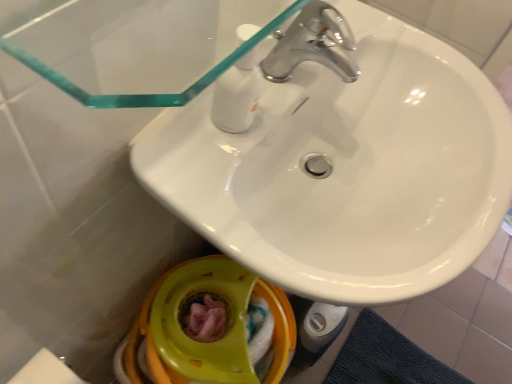
This screenshot has width=512, height=384. I want to click on chrome metallic faucet at upper center, which is the first tap from bottom to top, so click(312, 45).

The image size is (512, 384). Describe the element at coordinates (206, 343) in the screenshot. I see `matte yellow plastic toilet bowl at lower center` at that location.

Image resolution: width=512 pixels, height=384 pixels. What do you see at coordinates (346, 169) in the screenshot?
I see `white glossy sink at upper center` at bounding box center [346, 169].

Measure the distance between point (479,251) and camera.

Point (479,251) is 23.11 inches from camera.

You are a GUI agent. You are given a task and a screenshot of the screen. Output one action in this format:
    pyautogui.click(x=<x>, y=<y>)
    Task: Click on the chrome metallic faucet at upper center, which is the first tap from bottom to top
    Image resolution: width=512 pixels, height=384 pixels.
    Given the screenshot: What is the action you would take?
    pyautogui.click(x=312, y=45)

Would you say chrome metallic faucet at upper center, which is the first tap from bottom to top, is outside white glossy sink at upper center?

Absolutely, chrome metallic faucet at upper center, which is the first tap from bottom to top, is external to white glossy sink at upper center.

How many degrees apart are the facing directions of chrome metallic faucet at upper center, the second tap from the top, and white glossy sink at upper center?

They differ by 0.000368 degrees in their facing directions.

From a real-world perspective, which is physically below, chrome metallic faucet at upper center, the second tap from the top, or white glossy sink at upper center?

white glossy sink at upper center is physically lower.

Considering the sizes of objects chrome metallic faucet at upper center, the second tap from the top, and white glossy sink at upper center in the image provided, who is smaller, chrome metallic faucet at upper center, the second tap from the top, or white glossy sink at upper center?

chrome metallic faucet at upper center, the second tap from the top.

Between chrome metallic faucet at upper center, the 1th tap viewed from the top, and chrome metallic faucet at upper center, which is the first tap from bottom to top, which one appears on the right side from the viewer's perspective?

Positioned to the right is chrome metallic faucet at upper center, the 1th tap viewed from the top.

Can you confirm if chrome metallic faucet at upper center, arranged as the 2th tap when ordered from the bottom, is bigger than chrome metallic faucet at upper center, which is the first tap from bottom to top?

Incorrect, chrome metallic faucet at upper center, arranged as the 2th tap when ordered from the bottom, is not larger than chrome metallic faucet at upper center, which is the first tap from bottom to top.

Is chrome metallic faucet at upper center, arranged as the 2th tap when ordered from the bottom, looking in the opposite direction of chrome metallic faucet at upper center, which is the first tap from bottom to top?

No, chrome metallic faucet at upper center, arranged as the 2th tap when ordered from the bottom, is not facing the opposite direction of chrome metallic faucet at upper center, which is the first tap from bottom to top.

Is chrome metallic faucet at upper center, the 1th tap viewed from the top, placed right next to chrome metallic faucet at upper center, the second tap from the top?

Yes, chrome metallic faucet at upper center, the 1th tap viewed from the top, is right next to chrome metallic faucet at upper center, the second tap from the top, and making contact.

Is chrome metallic faucet at upper center, the 1th tap viewed from the top, at the back of chrome metallic faucet at upper center, which is the first tap from bottom to top?

No, chrome metallic faucet at upper center, which is the first tap from bottom to top,'s orientation is not away from chrome metallic faucet at upper center, the 1th tap viewed from the top.

Considering the sizes of chrome metallic faucet at upper center, which is the first tap from bottom to top, and chrome metallic faucet at upper center, arranged as the 2th tap when ordered from the bottom, in the image, is chrome metallic faucet at upper center, which is the first tap from bottom to top, taller or shorter than chrome metallic faucet at upper center, arranged as the 2th tap when ordered from the bottom,?

Clearly, chrome metallic faucet at upper center, which is the first tap from bottom to top, is taller compared to chrome metallic faucet at upper center, arranged as the 2th tap when ordered from the bottom.

Which object is wider, chrome metallic faucet at upper center, which is the first tap from bottom to top, or chrome metallic faucet at upper center, the 1th tap viewed from the top?

With larger width is chrome metallic faucet at upper center, which is the first tap from bottom to top.

Which object is positioned more to the right, chrome metallic faucet at upper center, the second tap from the top, or chrome metallic faucet at upper center, arranged as the 2th tap when ordered from the bottom?

From the viewer's perspective, chrome metallic faucet at upper center, arranged as the 2th tap when ordered from the bottom, appears more on the right side.

Measure the distance from matte yellow plastic toilet bowl at lower center to chrome metallic faucet at upper center, the 1th tap viewed from the top.

matte yellow plastic toilet bowl at lower center and chrome metallic faucet at upper center, the 1th tap viewed from the top, are 20.88 inches apart from each other.

Who is shorter, matte yellow plastic toilet bowl at lower center or chrome metallic faucet at upper center, the 1th tap viewed from the top?

chrome metallic faucet at upper center, the 1th tap viewed from the top, is shorter.

At what (x,y) coordinates should I click in order to perform the action: click on toilet bowl located below the chrome metallic faucet at upper center, the 1th tap viewed from the top (from the image's perspective). Please return your answer as a coordinate pair (x, y). Image resolution: width=512 pixels, height=384 pixels. Looking at the image, I should click on click(x=206, y=343).

Does matte yellow plastic toilet bowl at lower center have a lesser width compared to chrome metallic faucet at upper center, the 1th tap viewed from the top?

No, matte yellow plastic toilet bowl at lower center is not thinner than chrome metallic faucet at upper center, the 1th tap viewed from the top.

Considering the positions of point (226, 351) and point (346, 76), is point (226, 351) closer or farther from the camera than point (346, 76)?

Point (226, 351) appears to be farther away from the viewer than point (346, 76).

Between matte yellow plastic toilet bowl at lower center and chrome metallic faucet at upper center, the second tap from the top, which one has larger size?

matte yellow plastic toilet bowl at lower center.

Can you confirm if matte yellow plastic toilet bowl at lower center is positioned to the right of chrome metallic faucet at upper center, which is the first tap from bottom to top?

In fact, matte yellow plastic toilet bowl at lower center is to the left of chrome metallic faucet at upper center, which is the first tap from bottom to top.

Are matte yellow plastic toilet bowl at lower center and chrome metallic faucet at upper center, the second tap from the top, making contact?

matte yellow plastic toilet bowl at lower center and chrome metallic faucet at upper center, the second tap from the top, are clearly separated.

Which is correct: chrome metallic faucet at upper center, the second tap from the top, is inside matte yellow plastic toilet bowl at lower center, or outside of it?

Answer: chrome metallic faucet at upper center, the second tap from the top, is spatially situated outside matte yellow plastic toilet bowl at lower center.

Does chrome metallic faucet at upper center, which is the first tap from bottom to top, come in front of matte yellow plastic toilet bowl at lower center?

Yes, it is in front of matte yellow plastic toilet bowl at lower center.

Are chrome metallic faucet at upper center, the second tap from the top, and matte yellow plastic toilet bowl at lower center located far from each other?

They are positioned close to each other.

From the picture: Is chrome metallic faucet at upper center, arranged as the 2th tap when ordered from the bottom, wider than matte yellow plastic toilet bowl at lower center?

In fact, chrome metallic faucet at upper center, arranged as the 2th tap when ordered from the bottom, might be narrower than matte yellow plastic toilet bowl at lower center.

From the image's perspective, would you say chrome metallic faucet at upper center, the 1th tap viewed from the top, is shown under matte yellow plastic toilet bowl at lower center?

Incorrect, from the image's perspective, chrome metallic faucet at upper center, the 1th tap viewed from the top, is higher than matte yellow plastic toilet bowl at lower center.

The image size is (512, 384). There is a matte yellow plastic toilet bowl at lower center. Identify the location of the 1st tap above it (from a real-world perspective). tap(313, 44).

Locate an element on the screen. The width and height of the screenshot is (512, 384). sink located underneath the chrome metallic faucet at upper center, which is the first tap from bottom to top (from a real-world perspective) is located at coordinates (346, 169).

This screenshot has width=512, height=384. Identify the location of tap below the chrome metallic faucet at upper center, arranged as the 2th tap when ordered from the bottom (from the image's perspective). (312, 45).

Which object lies nearer to the anchor point matte yellow plastic toilet bowl at lower center, chrome metallic faucet at upper center, the second tap from the top, or chrome metallic faucet at upper center, arranged as the 2th tap when ordered from the bottom?

The object closer to matte yellow plastic toilet bowl at lower center is chrome metallic faucet at upper center, the second tap from the top.

From the image, which object appears to be nearer to white glossy sink at upper center, chrome metallic faucet at upper center, which is the first tap from bottom to top, or matte yellow plastic toilet bowl at lower center?

chrome metallic faucet at upper center, which is the first tap from bottom to top, lies closer to white glossy sink at upper center than the other object.

Based on their spatial positions, is white glossy sink at upper center or chrome metallic faucet at upper center, arranged as the 2th tap when ordered from the bottom, closer to chrome metallic faucet at upper center, the second tap from the top?

chrome metallic faucet at upper center, arranged as the 2th tap when ordered from the bottom, is closer to chrome metallic faucet at upper center, the second tap from the top.

Considering their positions, is white glossy sink at upper center positioned closer to matte yellow plastic toilet bowl at lower center than chrome metallic faucet at upper center, arranged as the 2th tap when ordered from the bottom?

white glossy sink at upper center lies closer to matte yellow plastic toilet bowl at lower center than the other object.

From the image, which object appears to be nearer to chrome metallic faucet at upper center, the second tap from the top, chrome metallic faucet at upper center, arranged as the 2th tap when ordered from the bottom, or matte yellow plastic toilet bowl at lower center?

chrome metallic faucet at upper center, arranged as the 2th tap when ordered from the bottom, lies closer to chrome metallic faucet at upper center, the second tap from the top, than the other object.

When comparing their distances from chrome metallic faucet at upper center, the 1th tap viewed from the top, does chrome metallic faucet at upper center, the second tap from the top, or white glossy sink at upper center seem further?

Based on the image, white glossy sink at upper center appears to be further to chrome metallic faucet at upper center, the 1th tap viewed from the top.

Based on their spatial positions, is chrome metallic faucet at upper center, the second tap from the top, or matte yellow plastic toilet bowl at lower center further from chrome metallic faucet at upper center, arranged as the 2th tap when ordered from the bottom?

matte yellow plastic toilet bowl at lower center lies further to chrome metallic faucet at upper center, arranged as the 2th tap when ordered from the bottom, than the other object.

From the image, which object appears to be farther from chrome metallic faucet at upper center, the 1th tap viewed from the top, matte yellow plastic toilet bowl at lower center or white glossy sink at upper center?

Based on the image, matte yellow plastic toilet bowl at lower center appears to be further to chrome metallic faucet at upper center, the 1th tap viewed from the top.

Locate an element on the screen. tap between chrome metallic faucet at upper center, the 1th tap viewed from the top, and matte yellow plastic toilet bowl at lower center from top to bottom is located at coordinates (312, 45).

The image size is (512, 384). In order to click on sink between chrome metallic faucet at upper center, arranged as the 2th tap when ordered from the bottom, and matte yellow plastic toilet bowl at lower center vertically in this screenshot , I will do `click(346, 169)`.

Find the location of a particular element. The width and height of the screenshot is (512, 384). tap between chrome metallic faucet at upper center, arranged as the 2th tap when ordered from the bottom, and white glossy sink at upper center vertically is located at coordinates (312, 45).

Identify the location of sink between chrome metallic faucet at upper center, the second tap from the top, and matte yellow plastic toilet bowl at lower center from top to bottom. (346, 169).